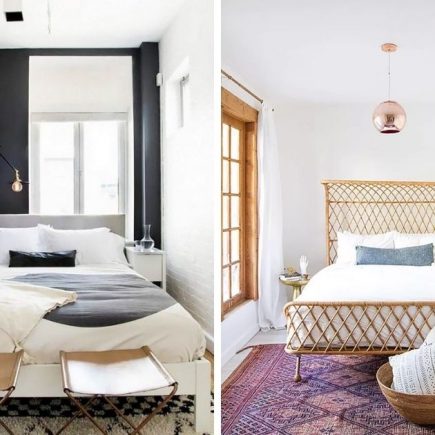
At what (x,y) coordinates should I click in order to perform the action: click on double windows. Please return your answer as a coordinate pair (x, y). This screenshot has width=435, height=435. Looking at the image, I should click on 108,176, 60,180.